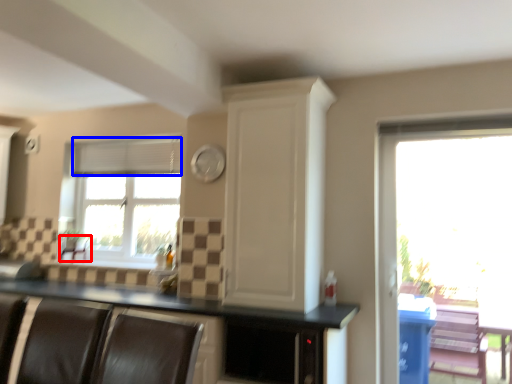
Question: Which object appears farthest to the camera in this image, armchair (highlighted by a red box) or blind (highlighted by a blue box)?

Choices:
 (A) armchair
 (B) blind

Answer: (A)